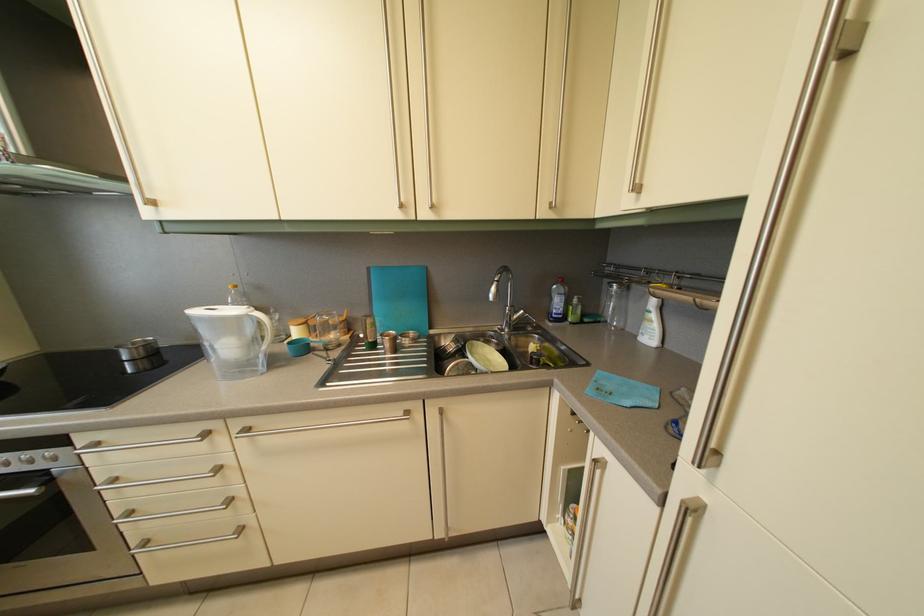
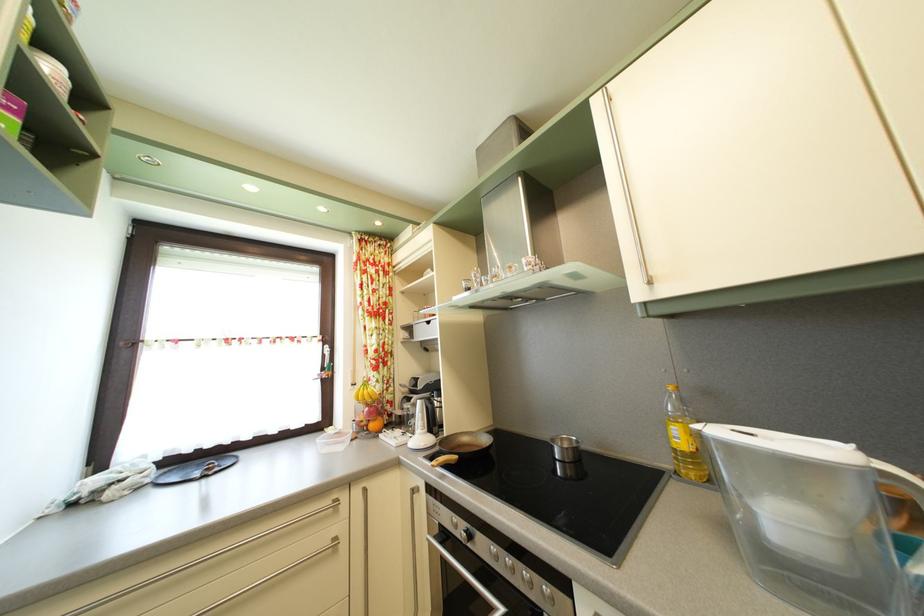
The point at (266, 296) is marked in the first image. Where is the corresponding point in the second image?

(715, 400)